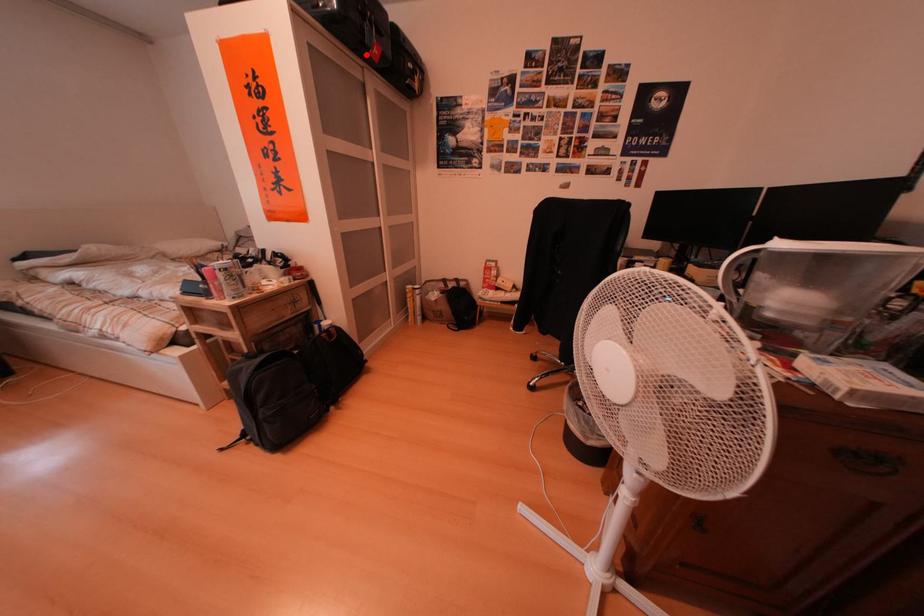
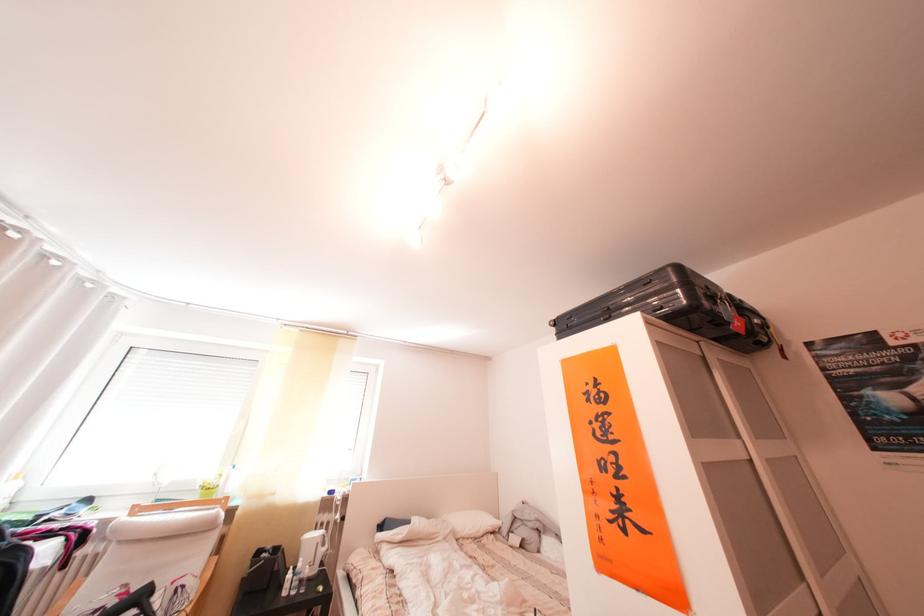
In the second image, find the point that corresponds to the highlighted location in the first image.

(703, 336)